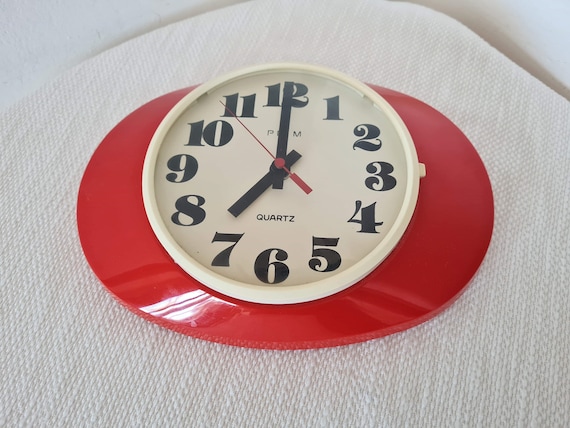
Locate an element on the screen. This screenshot has height=428, width=570. "3" on clock face is located at coordinates (384, 166).